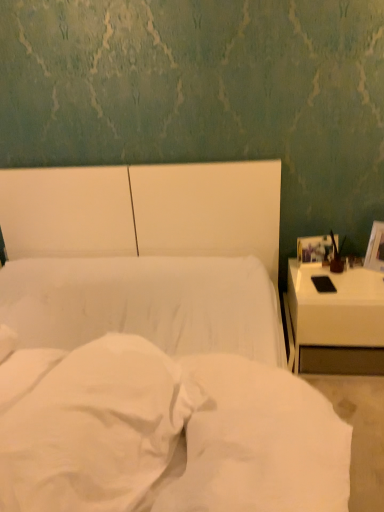
Question: Is white soft fabric at center facing towards matte brown vase at right?

Choices:
 (A) no
 (B) yes

Answer: (A)

Question: From a real-world perspective, is white soft fabric at center located higher than matte brown vase at right?

Choices:
 (A) yes
 (B) no

Answer: (A)

Question: Considering the relative positions of white soft fabric at center and matte brown vase at right in the image provided, is white soft fabric at center in front of matte brown vase at right?

Choices:
 (A) no
 (B) yes

Answer: (B)

Question: Is white soft fabric at center behind matte brown vase at right?

Choices:
 (A) yes
 (B) no

Answer: (B)

Question: Is white soft fabric at center to the right of matte brown vase at right from the viewer's perspective?

Choices:
 (A) no
 (B) yes

Answer: (A)

Question: Considering the relative sizes of white soft fabric at center and matte brown vase at right in the image provided, is white soft fabric at center taller than matte brown vase at right?

Choices:
 (A) yes
 (B) no

Answer: (A)

Question: Is white soft pillow at center shorter than white soft fabric at center?

Choices:
 (A) no
 (B) yes

Answer: (B)

Question: Is white soft pillow at center located outside white soft fabric at center?

Choices:
 (A) yes
 (B) no

Answer: (A)

Question: Considering the relative sizes of white soft pillow at center and white soft fabric at center in the image provided, is white soft pillow at center thinner than white soft fabric at center?

Choices:
 (A) no
 (B) yes

Answer: (A)

Question: Does white soft pillow at center come in front of white soft fabric at center?

Choices:
 (A) no
 (B) yes

Answer: (A)

Question: Does white soft pillow at center turn towards white soft fabric at center?

Choices:
 (A) yes
 (B) no

Answer: (A)

Question: Is white soft pillow at center surrounding white soft fabric at center?

Choices:
 (A) no
 (B) yes

Answer: (A)

Question: From a real-world perspective, is white glossy nightstand at right physically below white soft fabric at center?

Choices:
 (A) no
 (B) yes

Answer: (B)